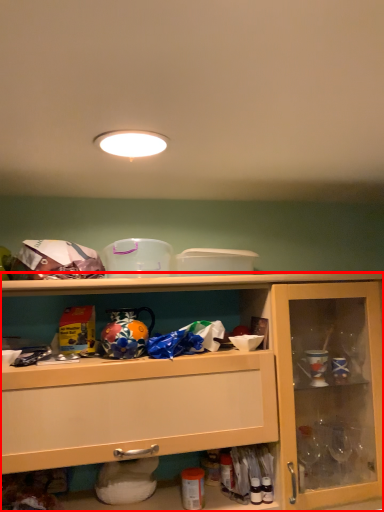
Question: Observing the image, what is the correct spatial positioning of cabinetry (annotated by the red box) in reference to lighting?

Choices:
 (A) right
 (B) left

Answer: (A)